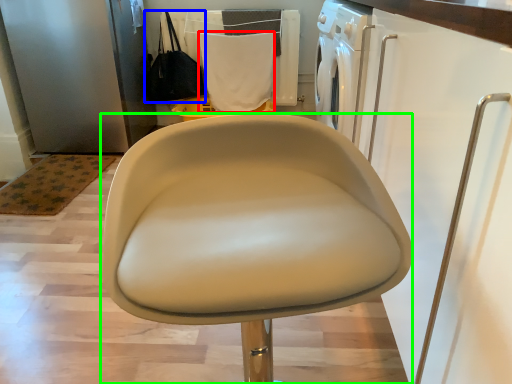
Question: Based on their relative distances, which object is farther from cloth (highlighted by a red box)? Choose from handbag (highlighted by a blue box) and chair (highlighted by a green box).

Choices:
 (A) handbag
 (B) chair

Answer: (B)